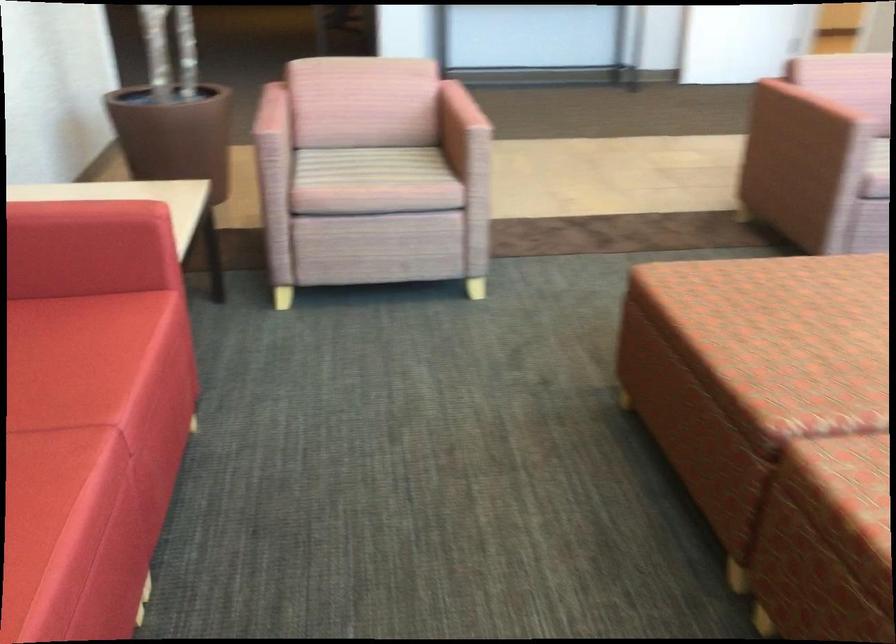
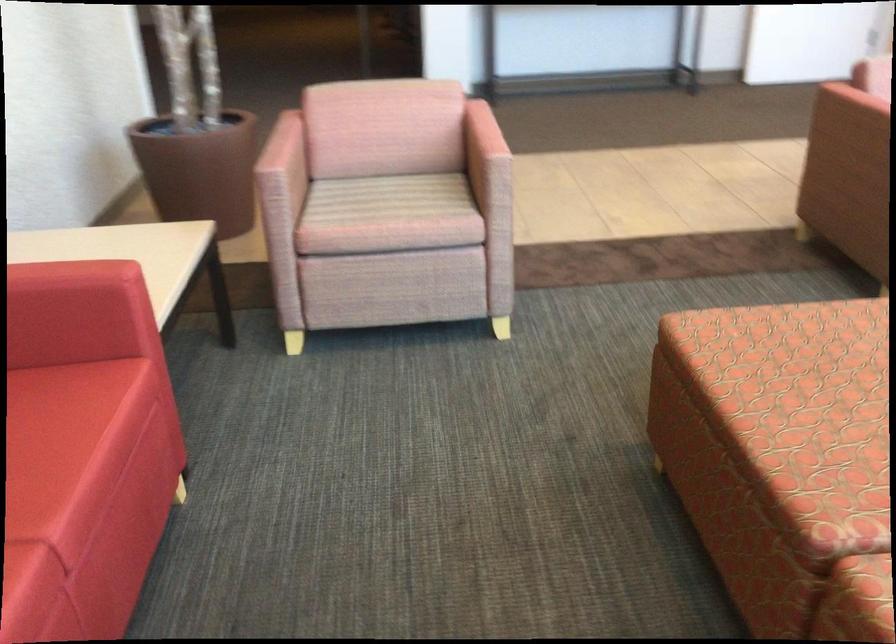
The point at (78, 328) is marked in the first image. Where is the corresponding point in the second image?

(38, 408)